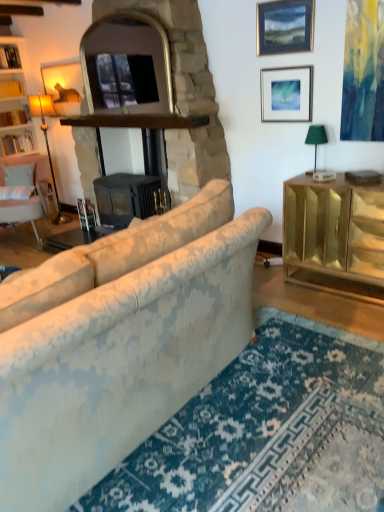
This screenshot has width=384, height=512. Find the location of `blank space situated above gold mirrored cabinet at right (from a real-world perspective)`. blank space situated above gold mirrored cabinet at right (from a real-world perspective) is located at coordinates (340, 179).